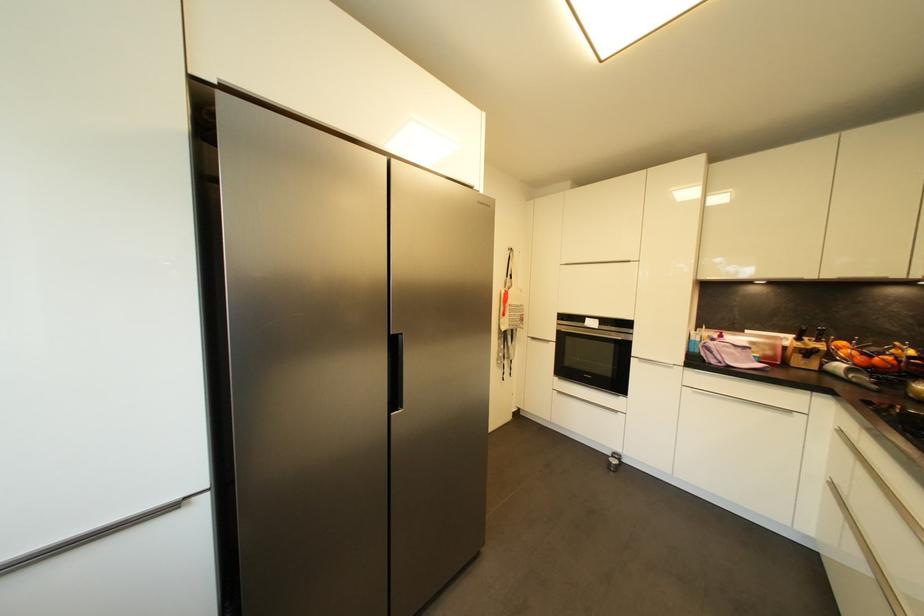
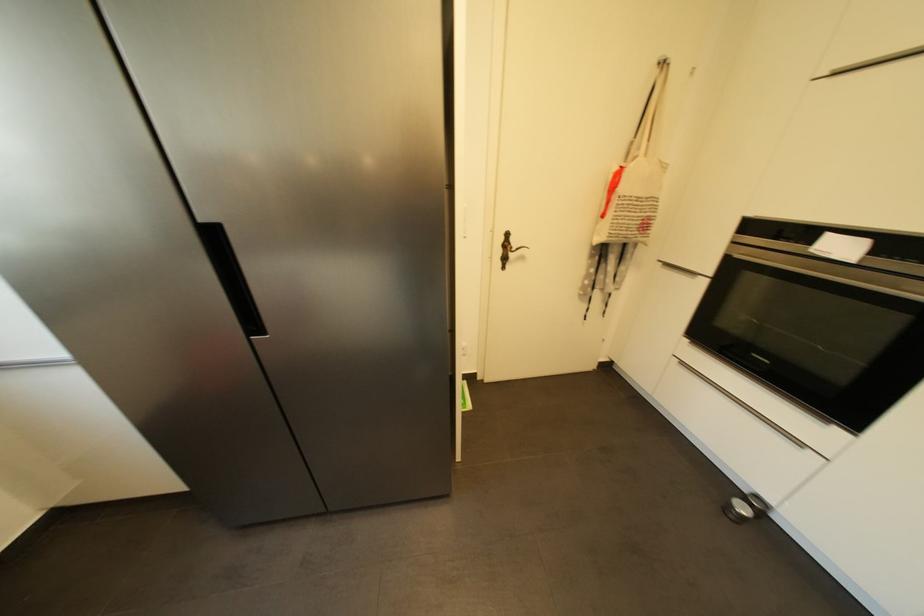
The images are taken continuously from a first-person perspective. In which direction is your viewpoint rotating?

The camera's rotation is toward left-down.